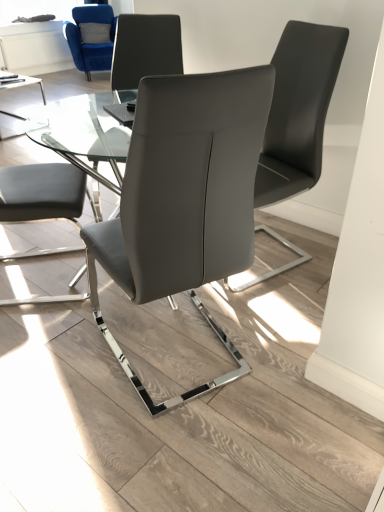
Question: Considering the positions of matte gray chair at center, arranged as the 4th chair when viewed from the left, and transparent glass table at center in the image, is matte gray chair at center, arranged as the 4th chair when viewed from the left, bigger or smaller than transparent glass table at center?

Choices:
 (A) small
 (B) big

Answer: (A)

Question: From a real-world perspective, is matte gray chair at center, the first chair when ordered from right to left, above or below transparent glass table at center?

Choices:
 (A) below
 (B) above

Answer: (B)

Question: Which object is positioned farthest from the matte gray chair at center, which is the third chair from right to left?

Choices:
 (A) matte gray chair at center, arranged as the first chair when viewed from the front
 (B) transparent glass window screen at upper left
 (C) matte gray chair at center, the 2th chair in the bottom-to-top sequence
 (D) transparent glass table at center
 (E) velvet blue armchair at upper left, which is the 4th chair in front-to-back order

Answer: (B)

Question: Considering the real-world distances, which object is farthest from the matte gray chair at center, placed as the first chair when sorted from bottom to top?

Choices:
 (A) transparent glass table at center
 (B) matte gray chair at center, the 2th chair in the bottom-to-top sequence
 (C) matte gray chair at center, the second chair from the top
 (D) transparent glass window screen at upper left
 (E) velvet blue armchair at upper left, which is the 4th chair in front-to-back order

Answer: (D)